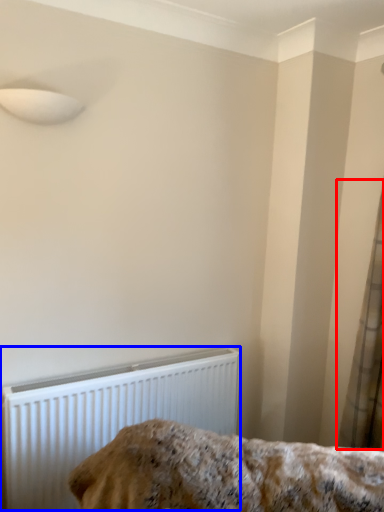
Question: Which object appears farthest to the camera in this image, curtain (highlighted by a red box) or radiator (highlighted by a blue box)?

Choices:
 (A) curtain
 (B) radiator

Answer: (A)